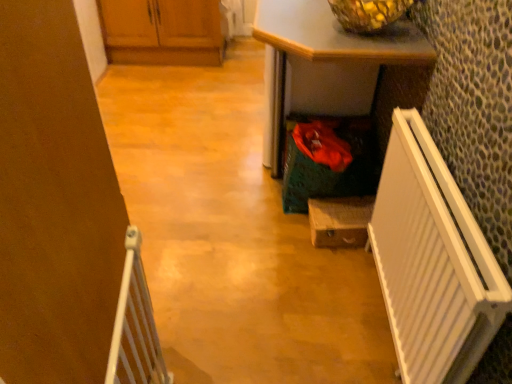
The height and width of the screenshot is (384, 512). I want to click on free region under white plastic radiator at right, acting as the first radiator starting from the right (from a real-world perspective), so click(x=376, y=314).